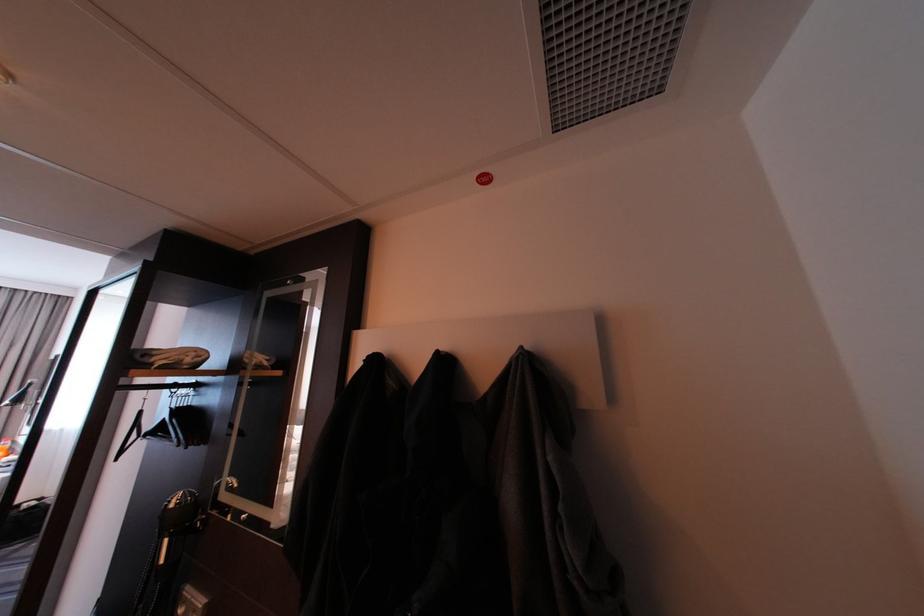
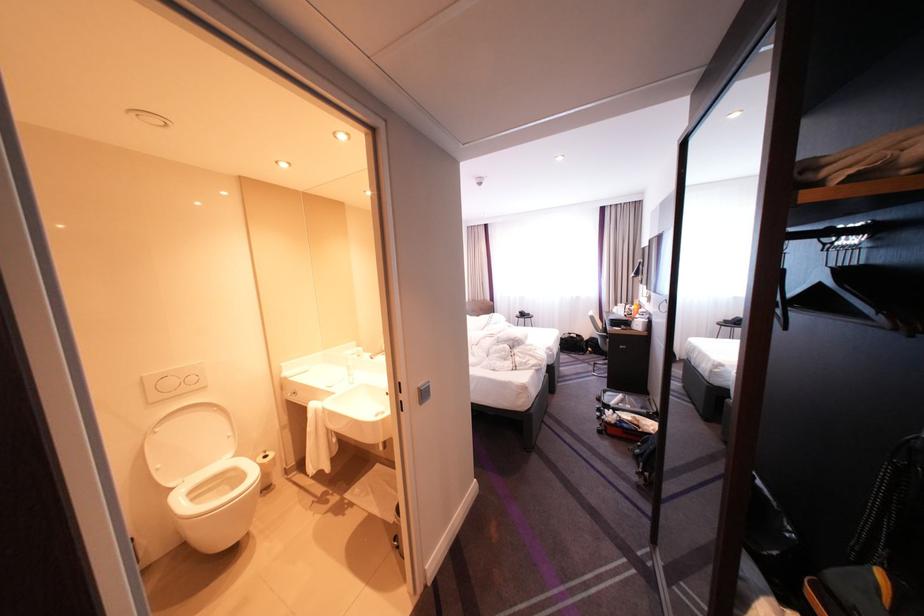
Find the pixel in the second image that matches (x=191, y=407) in the first image.

(855, 265)